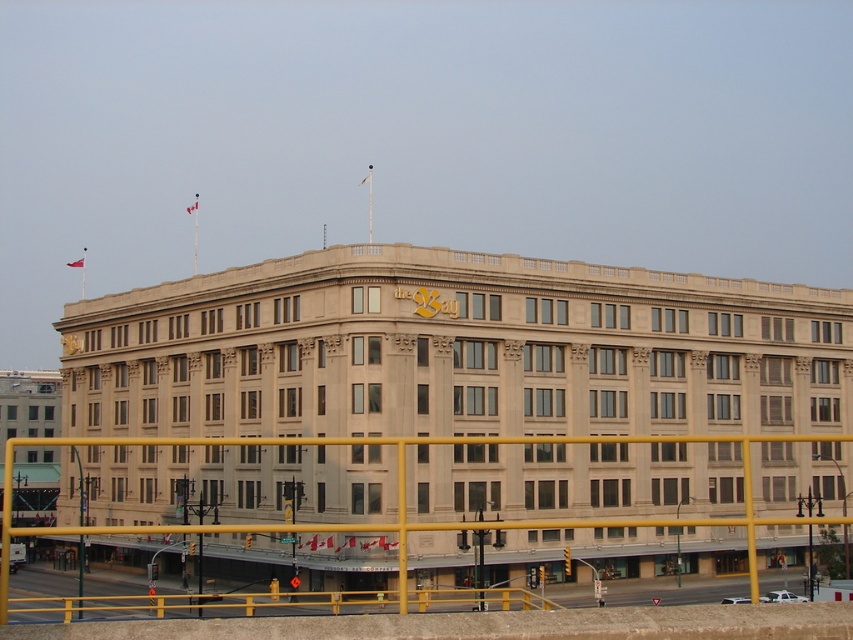
You are standing in front of the building and want to place a new decorative item between the yellow metallic pole at lower left and the gold metallic clock at upper center. Considering their sizes, which object should you place closer to the center of the building to maintain balance?

Since the yellow metallic pole at lower left is larger than the gold metallic clock at upper center, you should place the new decorative item closer to the gold metallic clock at upper center to balance their sizes.

You are a delivery person trying to park your 1.2 meter wide delivery cart near the yellow metallic pole at lower left and the gold metallic clock at upper center. Based on their widths, which object would allow your cart to fit better next to it?

The yellow metallic pole at lower left might be wider than gold metallic clock at upper center, so the gold metallic clock at upper center would allow the cart to fit better since it is narrower.

You are standing in front of the building and need to locate the yellow metallic pole at lower left and the gold metallic clock at upper center. Which object is positioned to the right of the other?

The yellow metallic pole at lower left is positioned on the right side of gold metallic clock at upper center.